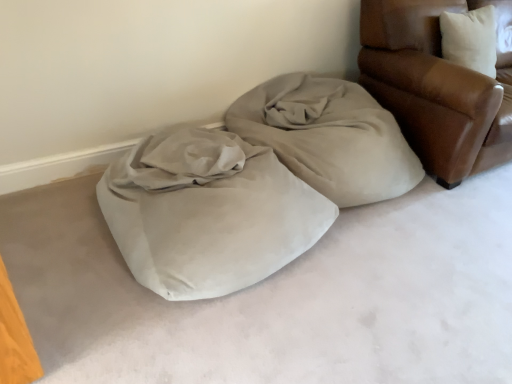
Describe the element at coordinates (252, 185) in the screenshot. This screenshot has width=512, height=384. I see `suede-like beige bean bag at center` at that location.

The height and width of the screenshot is (384, 512). Find the location of `suede-like beige bean bag at center`. suede-like beige bean bag at center is located at coordinates click(252, 185).

In the scene shown: Is beige fabric at center located outside leather armchair at upper right?

beige fabric at center lies outside leather armchair at upper right's area.

Which object is positioned more to the left, beige fabric at center or leather armchair at upper right?

Positioned to the left is beige fabric at center.

Which object is further away from the camera taking this photo, beige fabric at center or leather armchair at upper right?

beige fabric at center is further away from the camera.

Considering the sizes of objects beige fabric at center and leather armchair at upper right in the image provided, who is smaller, beige fabric at center or leather armchair at upper right?

With smaller size is beige fabric at center.

Who is smaller, leather armchair at upper right or beige fabric at center?

With smaller size is beige fabric at center.

Considering the relative sizes of leather armchair at upper right and beige fabric at center in the image provided, is leather armchair at upper right shorter than beige fabric at center?

No.

Is beige fabric at center located within leather armchair at upper right?

That's incorrect, beige fabric at center is not inside leather armchair at upper right.

What's the angular difference between suede-like beige bean bag at center and leather armchair at upper right's facing directions?

suede-like beige bean bag at center and leather armchair at upper right are facing 0.00012 degrees away from each other.

Is point (212, 169) positioned behind point (406, 115)?

No, (212, 169) is closer to viewer.

Which of these two, suede-like beige bean bag at center or leather armchair at upper right, stands shorter?

suede-like beige bean bag at center is shorter.

From a real-world perspective, is leather armchair at upper right on suede-like beige bean bag at center?

Yes, from a real-world perspective, leather armchair at upper right is on top of suede-like beige bean bag at center.

Is suede-like beige bean bag at center at the back of leather armchair at upper right?

No.

From the image's perspective, relative to suede-like beige bean bag at center, is leather armchair at upper right above or below?

leather armchair at upper right is situated higher than suede-like beige bean bag at center in the image.

From the picture: Is leather armchair at upper right further to camera compared to suede-like beige bean bag at center?

Yes, leather armchair at upper right is further from the camera.

Which of these two, suede-like beige bean bag at center or beige fabric at center, is smaller?

Smaller between the two is beige fabric at center.

Is suede-like beige bean bag at center in contact with beige fabric at center?

No, suede-like beige bean bag at center is not next to beige fabric at center.

Looking at this image, what's the angular difference between suede-like beige bean bag at center and beige fabric at center's facing directions?

They differ by 0.000207 degrees in their facing directions.

You are a GUI agent. You are given a task and a screenshot of the screen. Output one action in this format:
    pyautogui.click(x=<x>, y=<y>)
    Task: Click on the cloth located above the suede-like beige bean bag at center (from the image's perspective)
    The width and height of the screenshot is (512, 384).
    Given the screenshot: What is the action you would take?
    pyautogui.click(x=328, y=137)

From the image's perspective, does beige fabric at center appear lower than suede-like beige bean bag at center?

No, from the image's perspective, beige fabric at center is not below suede-like beige bean bag at center.

Is beige fabric at center touching suede-like beige bean bag at center?

No, beige fabric at center is not with suede-like beige bean bag at center.

Is beige fabric at center surrounding suede-like beige bean bag at center?

No, suede-like beige bean bag at center is not surrounded by beige fabric at center.

From a real-world perspective, is beige fabric at center beneath suede-like beige bean bag at center?

Incorrect, from a real-world perspective, beige fabric at center is higher than suede-like beige bean bag at center.

In order to click on furniture in front of the beige fabric at center in this screenshot , I will do `click(436, 87)`.

The image size is (512, 384). In the image, there is a leather armchair at upper right. Find the location of `cloth below it (from the image's perspective)`. cloth below it (from the image's perspective) is located at coordinates (328, 137).

Looking at the image, which one is located further to leather armchair at upper right, beige fabric at center or suede-like beige bean bag at center?

suede-like beige bean bag at center lies further to leather armchair at upper right than the other object.

Considering their positions, is suede-like beige bean bag at center positioned further to beige fabric at center than leather armchair at upper right?

leather armchair at upper right is positioned further to the anchor beige fabric at center.

When comparing their distances from suede-like beige bean bag at center, does beige fabric at center or leather armchair at upper right seem further?

Among the two, leather armchair at upper right is located further to suede-like beige bean bag at center.

Considering their positions, is leather armchair at upper right positioned closer to beige fabric at center than suede-like beige bean bag at center?

Among the two, suede-like beige bean bag at center is located nearer to beige fabric at center.

When comparing their distances from leather armchair at upper right, does suede-like beige bean bag at center or beige fabric at center seem closer?

beige fabric at center.

Which object lies nearer to the anchor point suede-like beige bean bag at center, leather armchair at upper right or beige fabric at center?

The object closer to suede-like beige bean bag at center is beige fabric at center.

This screenshot has height=384, width=512. Identify the location of cloth between suede-like beige bean bag at center and leather armchair at upper right in the horizontal direction. (328, 137).